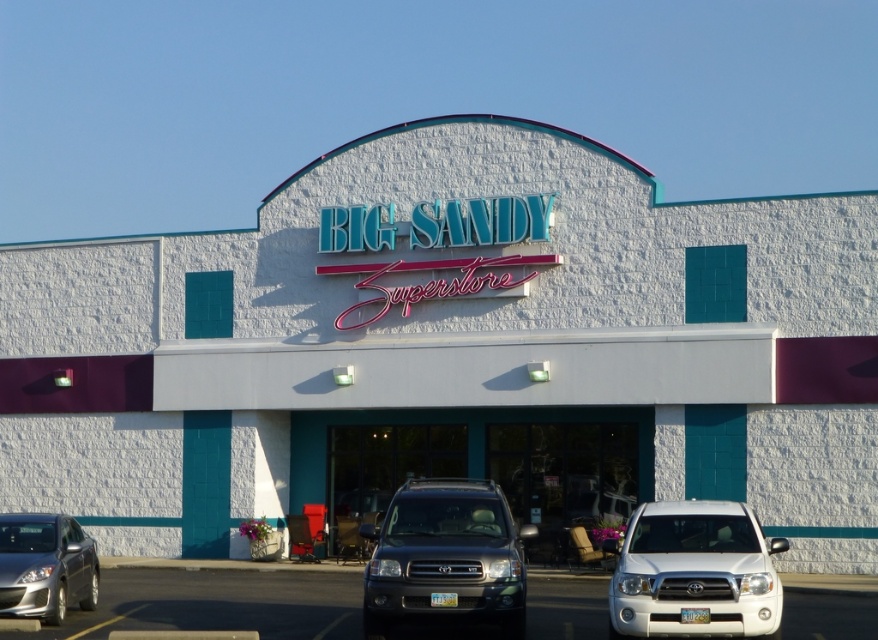
Question: Does white stucco building at center appear on the left side of satin white suv at lower right?

Choices:
 (A) yes
 (B) no

Answer: (A)

Question: Which of these objects is positioned farthest from the metallic gray suvs at center?

Choices:
 (A) satin silver suv at center
 (B) white stucco building at center
 (C) silver metallic sedan at lower left
 (D) satin white suv at lower right

Answer: (D)

Question: Which object appears farthest from the camera in this image?

Choices:
 (A) satin silver suv at center
 (B) silver metallic sedan at lower left
 (C) white stucco building at center
 (D) satin white suv at lower right

Answer: (C)

Question: Is metallic gray suvs at center further to camera compared to satin white suv at lower right?

Choices:
 (A) yes
 (B) no

Answer: (A)

Question: Among these points, which one is nearest to the camera?

Choices:
 (A) (727, 632)
 (B) (308, 592)
 (C) (457, 609)

Answer: (A)

Question: Can you confirm if white stucco building at center is thinner than satin white suv at lower right?

Choices:
 (A) yes
 (B) no

Answer: (B)